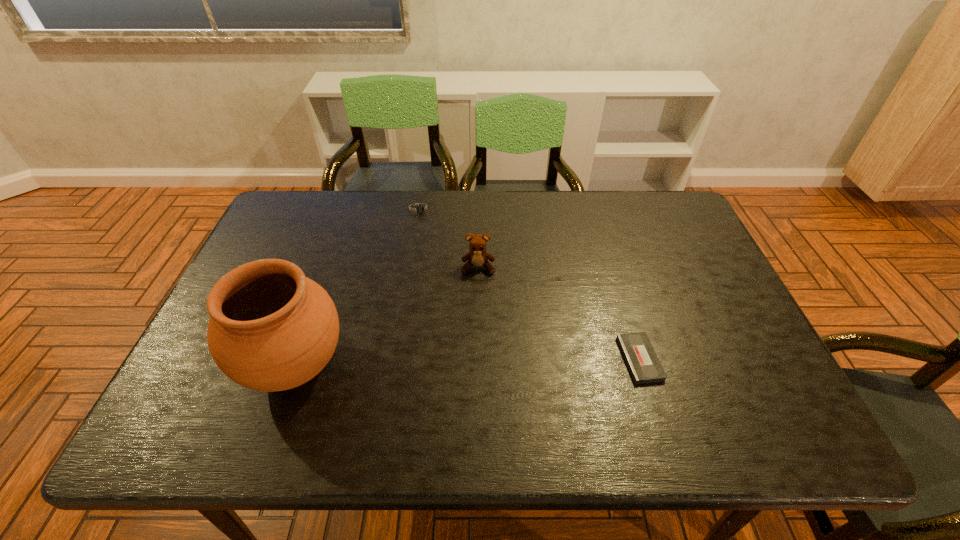
Locate an element on the screen. This screenshot has width=960, height=540. object located at the near left corner is located at coordinates (271, 329).

The width and height of the screenshot is (960, 540). Identify the location of free space at the far edge of the desktop. (519, 196).

I want to click on vacant space at the near edge of the desktop, so pos(485,386).

The height and width of the screenshot is (540, 960). Identify the location of vacant space at the right edge of the desktop. (678, 286).

Find the location of a particular element. The width and height of the screenshot is (960, 540). vacant space at the far left corner is located at coordinates (319, 204).

The height and width of the screenshot is (540, 960). Find the location of `vacant space at the far right corner of the desktop`. vacant space at the far right corner of the desktop is located at coordinates (631, 199).

You are a GUI agent. You are given a task and a screenshot of the screen. Output one action in this format:
    pyautogui.click(x=<x>, y=<y>)
    Task: Click on the vacant space that is in between the second tallest object and the watch
    
    Given the screenshot: What is the action you would take?
    tap(449, 238)

Identify the location of free space that is in between the second tallest object and the farthest object. (449, 238).

Find the location of a particular element. empty space that is in between the leftmost object and the videotape is located at coordinates (x=468, y=362).

Find the location of a particular element. The width and height of the screenshot is (960, 540). vacant region between the third object from right to left and the teddy bear is located at coordinates (449, 238).